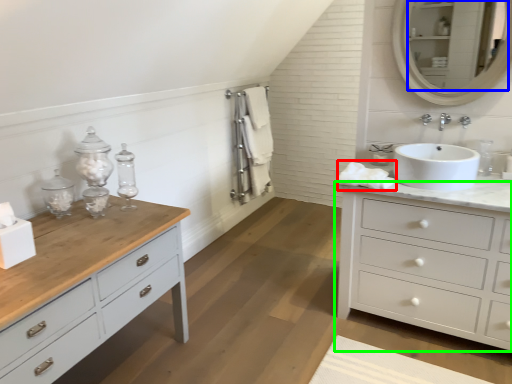
Question: Estimate the real-world distances between objects in this image. Which object is farther from bath towel (highlighted by a red box), mirror (highlighted by a blue box) or chest of drawers (highlighted by a green box)?

Choices:
 (A) mirror
 (B) chest of drawers

Answer: (A)